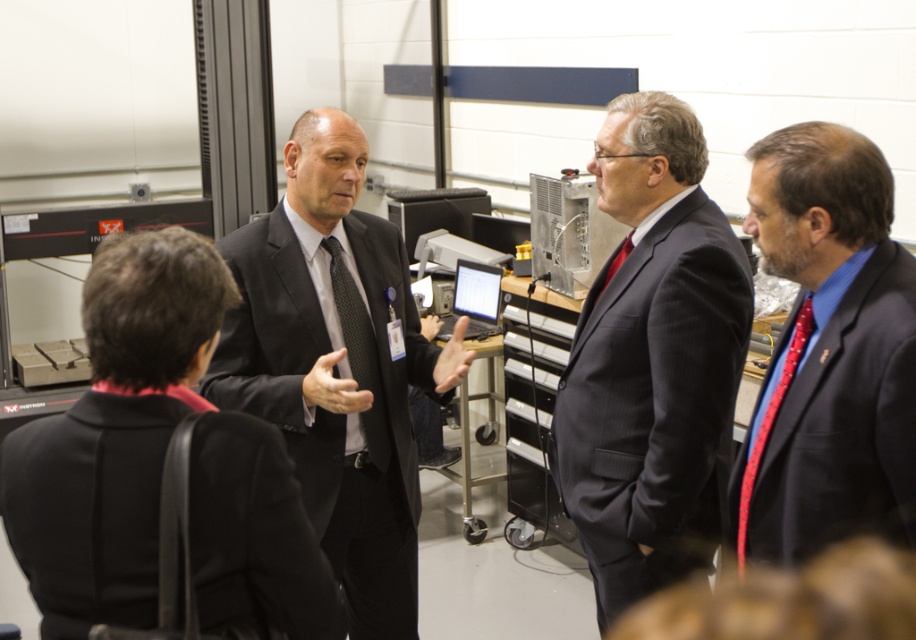
Does black dotted tie at center appear on the left side of red silk tie at right?

Yes, black dotted tie at center is to the left of red silk tie at right.

Does black dotted tie at center have a lesser width compared to red silk tie at right?

Incorrect, black dotted tie at center's width is not less than red silk tie at right's.

Is point (346, 273) less distant than point (805, 316)?

No.

Where is `black dotted tie at center`? The image size is (916, 640). black dotted tie at center is located at coordinates (358, 353).

Which is more to the left, black dotted tie at center or red silk tie at center?

Positioned to the left is black dotted tie at center.

Is black dotted tie at center bigger than red silk tie at center?

Yes, black dotted tie at center is bigger than red silk tie at center.

The height and width of the screenshot is (640, 916). I want to click on black dotted tie at center, so click(x=358, y=353).

Locate an element on the screen. dark blue pinstripe suit at center is located at coordinates (652, 362).

Does dark blue pinstripe suit at center have a lesser height compared to red silk tie at right?

No.

From the picture: Who is more forward, (635, 420) or (764, 422)?

Point (764, 422)

Locate an element on the screen. dark blue pinstripe suit at center is located at coordinates (652, 362).